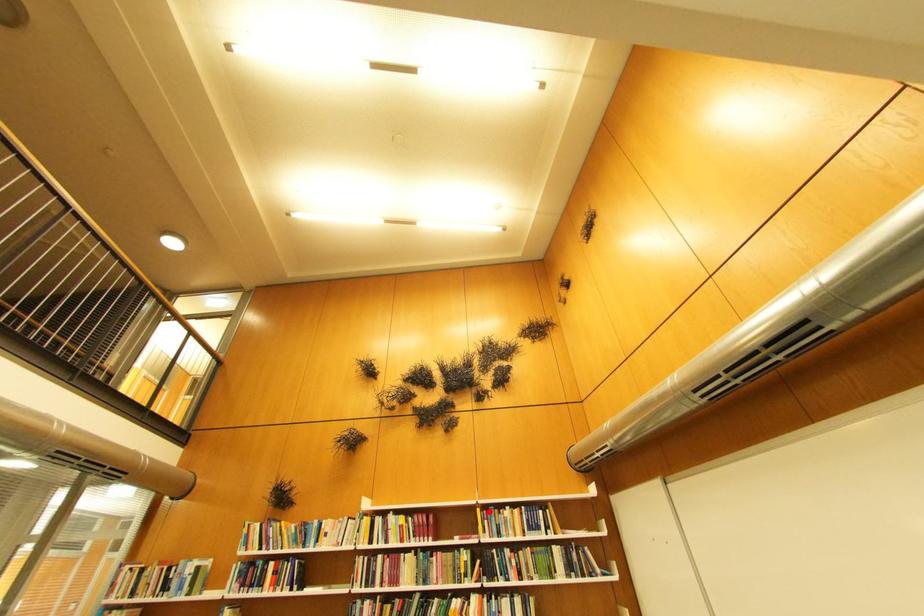
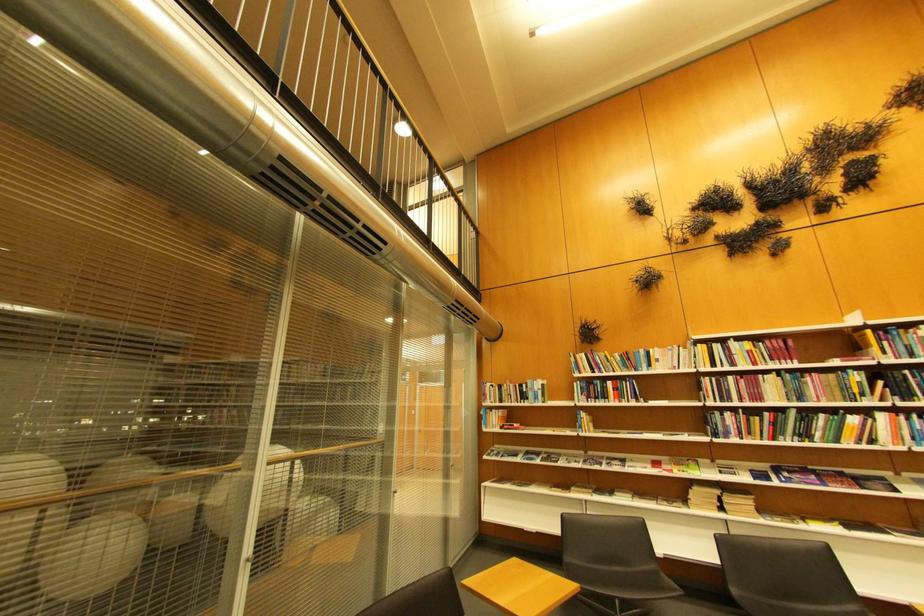
Question: I am providing you with two images of the same scene from different viewpoints. A red point is marked on the first image. Can you still see the location of the red point in image 2?

Choices:
 (A) Yes
 (B) No

Answer: (A)